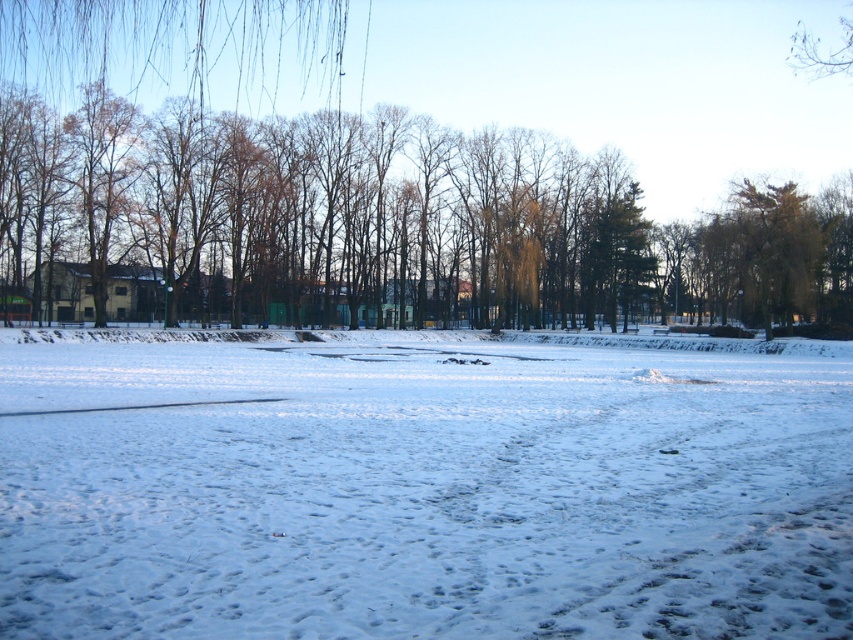
Question: Considering the relative positions of white powdery snow at center and brown leafless tree at left in the image provided, where is white powdery snow at center located with respect to brown leafless tree at left?

Choices:
 (A) left
 (B) right

Answer: (A)

Question: Is white powdery snow at center to the left of brown leafless tree at left from the viewer's perspective?

Choices:
 (A) yes
 (B) no

Answer: (A)

Question: Does white powdery snow at center have a lesser width compared to brown leafless tree at left?

Choices:
 (A) no
 (B) yes

Answer: (B)

Question: Among these objects, which one is farthest from the camera?

Choices:
 (A) white powdery snow at center
 (B) brown leafless tree at left

Answer: (B)